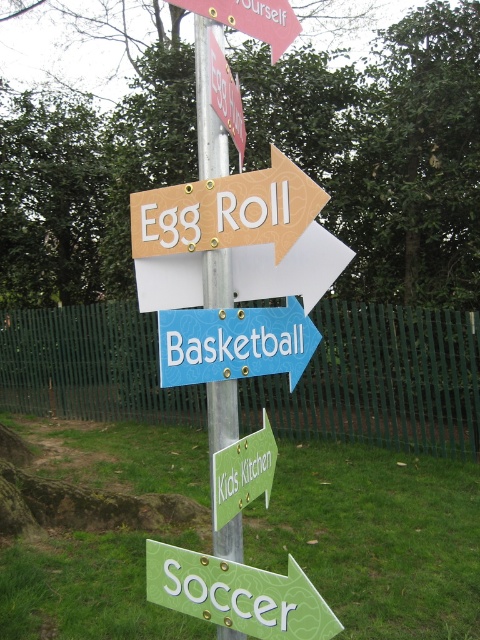
Looking at this image, you are standing in front of a metal pole with several signs. You see a green matte arrow at lower center and a blue plastic basketball at center. Which object is taller?

The green matte arrow at lower center is taller than the blue plastic basketball at center.

You are standing in front of a metal pole with two signs. The first is the matte wooden sign at upper center and the second is the green matte arrow at lower center. Which of these two signs is located higher up on the pole?

The matte wooden sign at upper center is positioned over the green matte arrow at lower center, so it is higher up on the pole.

You are standing 5 feet away from the metal pole with signs. You want to see the matte wooden sign at upper center clearly. Can you move closer to it?

A: The matte wooden sign at upper center is 4.25 feet away from the camera. Since you are currently 5 feet away from the metal pole with signs, moving closer by 0.75 feet would allow you to see the matte wooden sign at upper center clearly.